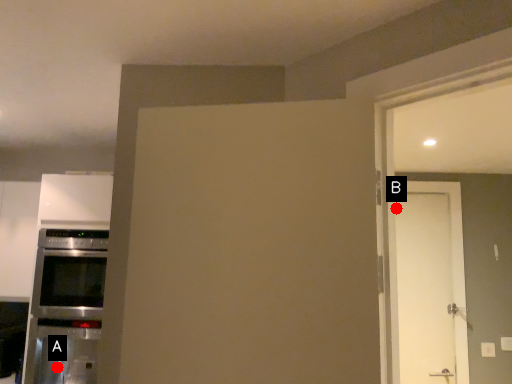
Question: Two points are circled on the image, labeled by A and B beside each circle. Which point is closer to the camera?

Choices:
 (A) A is closer
 (B) B is closer

Answer: (A)